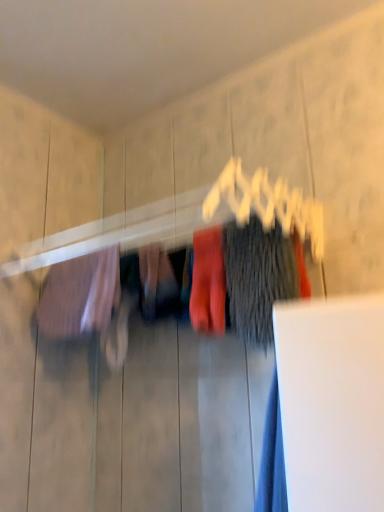
Question: Are dark gray fuzzy sweater at center, placed as the 3th clothing when sorted from left to right, and matte red socks at center, the 2th clothing in the left-to-right sequence, located far from each other?

Choices:
 (A) yes
 (B) no

Answer: (B)

Question: Is dark gray fuzzy sweater at center, acting as the 1th clothing starting from the right, at the left side of matte red socks at center, the 2th clothing in the left-to-right sequence?

Choices:
 (A) yes
 (B) no

Answer: (B)

Question: From the image's perspective, does dark gray fuzzy sweater at center, acting as the 1th clothing starting from the right, appear higher than matte red socks at center, which is the 2th clothing from right to left?

Choices:
 (A) yes
 (B) no

Answer: (A)

Question: Is the depth of dark gray fuzzy sweater at center, acting as the 1th clothing starting from the right, less than that of matte red socks at center, the 2th clothing in the left-to-right sequence?

Choices:
 (A) yes
 (B) no

Answer: (A)

Question: Considering the relative sizes of dark gray fuzzy sweater at center, placed as the 3th clothing when sorted from left to right, and matte red socks at center, the 2th clothing in the left-to-right sequence, in the image provided, is dark gray fuzzy sweater at center, placed as the 3th clothing when sorted from left to right, shorter than matte red socks at center, the 2th clothing in the left-to-right sequence,?

Choices:
 (A) yes
 (B) no

Answer: (B)

Question: Is dark gray fuzzy sweater at center, acting as the 1th clothing starting from the right, further to camera compared to matte red socks at center, which is the 2th clothing from right to left?

Choices:
 (A) yes
 (B) no

Answer: (B)

Question: From the image's perspective, would you say matte pink fabric at left, marked as the first clothing in a left-to-right arrangement, is positioned over dark gray fuzzy sweater at center, placed as the 3th clothing when sorted from left to right?

Choices:
 (A) yes
 (B) no

Answer: (B)

Question: Is matte pink fabric at left, which is the third clothing in right-to-left order, positioned far away from dark gray fuzzy sweater at center, acting as the 1th clothing starting from the right?

Choices:
 (A) yes
 (B) no

Answer: (B)

Question: Does matte pink fabric at left, which is the third clothing in right-to-left order, have a smaller size compared to dark gray fuzzy sweater at center, acting as the 1th clothing starting from the right?

Choices:
 (A) no
 (B) yes

Answer: (A)

Question: From the image's perspective, is matte pink fabric at left, which is the third clothing in right-to-left order, located beneath dark gray fuzzy sweater at center, acting as the 1th clothing starting from the right?

Choices:
 (A) no
 (B) yes

Answer: (B)

Question: Is dark gray fuzzy sweater at center, acting as the 1th clothing starting from the right, completely or partially inside matte pink fabric at left, which is the third clothing in right-to-left order?

Choices:
 (A) no
 (B) yes

Answer: (A)

Question: Considering the relative sizes of matte pink fabric at left, marked as the first clothing in a left-to-right arrangement, and dark gray fuzzy sweater at center, acting as the 1th clothing starting from the right, in the image provided, is matte pink fabric at left, marked as the first clothing in a left-to-right arrangement, taller than dark gray fuzzy sweater at center, acting as the 1th clothing starting from the right,?

Choices:
 (A) no
 (B) yes

Answer: (A)

Question: Is matte red socks at center, the 2th clothing in the left-to-right sequence, closer to the viewer compared to dark gray fuzzy sweater at center, acting as the 1th clothing starting from the right?

Choices:
 (A) yes
 (B) no

Answer: (B)